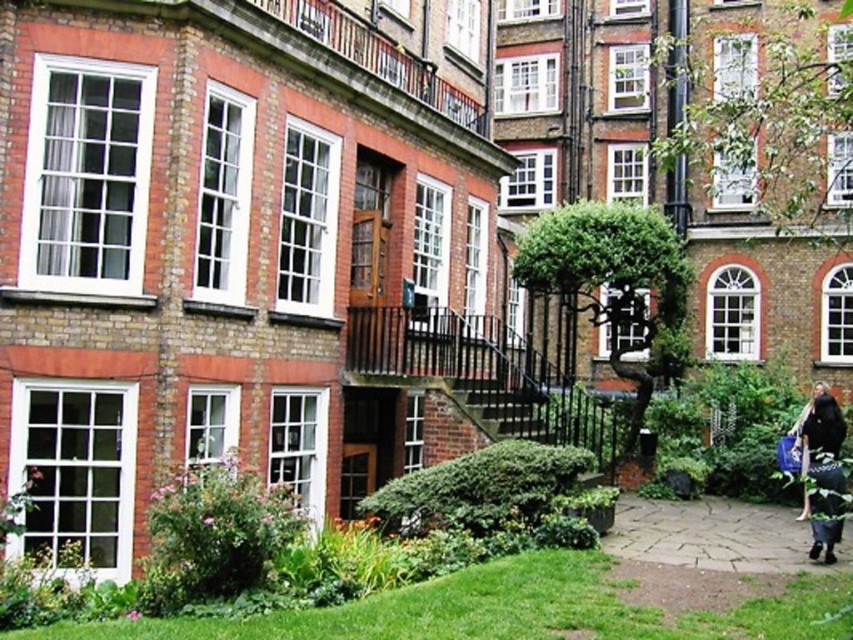
Question: In this image, where is smooth stone path at lower right located relative to dark blue fabric bag at lower right?

Choices:
 (A) below
 (B) above

Answer: (A)

Question: Which point is closer to the camera taking this photo?

Choices:
 (A) (825, 465)
 (B) (677, 547)

Answer: (A)

Question: Which point is farther from the camera taking this photo?

Choices:
 (A) [x=650, y=544]
 (B) [x=828, y=547]

Answer: (A)

Question: Does smooth stone path at lower right appear under dark blue fabric bag at lower right?

Choices:
 (A) yes
 (B) no

Answer: (A)

Question: Is smooth stone path at lower right behind dark blue fabric bag at lower right?

Choices:
 (A) yes
 (B) no

Answer: (B)